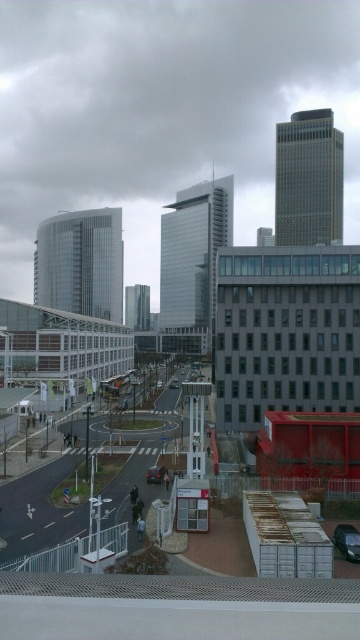
Question: Where is shiny black car at lower right located in relation to shiny black car at center in the image?

Choices:
 (A) above
 (B) below

Answer: (A)

Question: Can you confirm if shiny black car at lower right is smaller than shiny black car at center?

Choices:
 (A) yes
 (B) no

Answer: (A)

Question: Which object is closer to the camera taking this photo?

Choices:
 (A) shiny black car at center
 (B) shiny black car at lower right

Answer: (B)

Question: Which point is closer to the camera?

Choices:
 (A) (151, 467)
 (B) (343, 529)

Answer: (B)

Question: Among these points, which one is nearest to the camera?

Choices:
 (A) (357, 545)
 (B) (159, 472)

Answer: (A)

Question: Where is shiny black car at lower right located in relation to shiny black car at center in the image?

Choices:
 (A) left
 (B) right

Answer: (B)